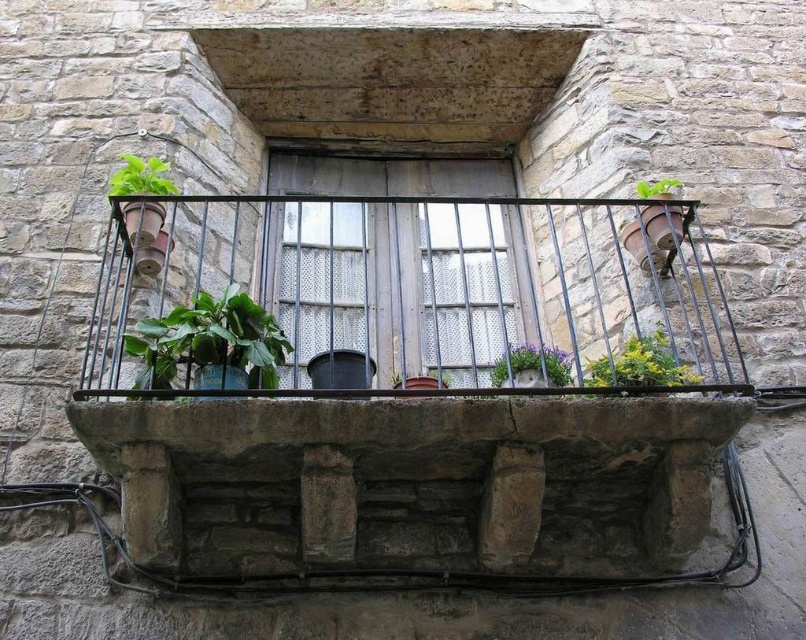
You are a gardener who needs to determine which plant is taller between the purple matte flower pot at center and the green matte plant at upper right. Based on the balcony scene described, which one is taller?

The purple matte flower pot at center is much taller than the green matte plant at upper right, so the purple matte flower pot at center is taller.

Based on the scene description, where exactly are the green leafy plants at center located in the image?

The green leafy plants at center are located at point coordinates of (405, 387).